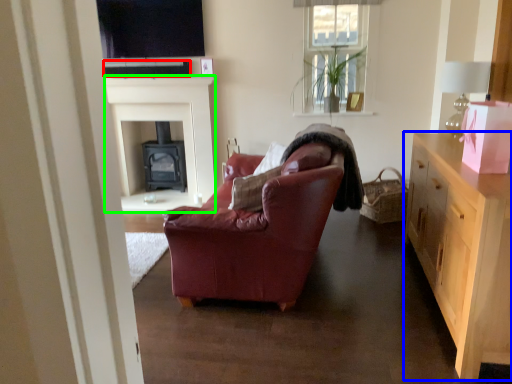
Question: Which object is the farthest from loudspeaker (highlighted by a red box)? Choose among these: cabinetry (highlighted by a blue box) or fireplace (highlighted by a green box).

Choices:
 (A) cabinetry
 (B) fireplace

Answer: (A)